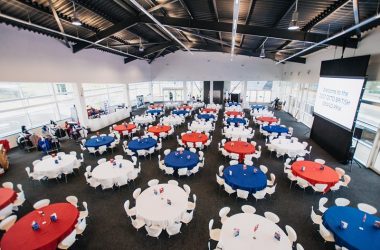
Where is `screen`? The width and height of the screenshot is (380, 250). screen is located at coordinates (332, 99).